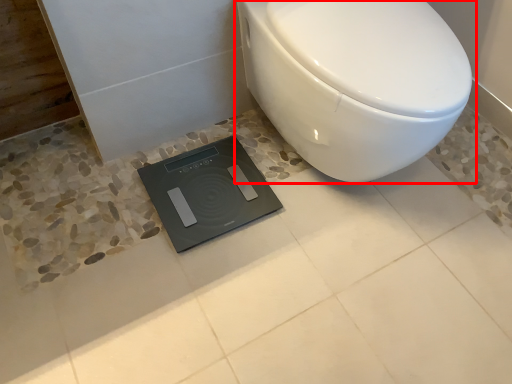
Question: Observing the image, what is the correct spatial positioning of toilet (annotated by the red box) in reference to scale?

Choices:
 (A) right
 (B) left

Answer: (A)